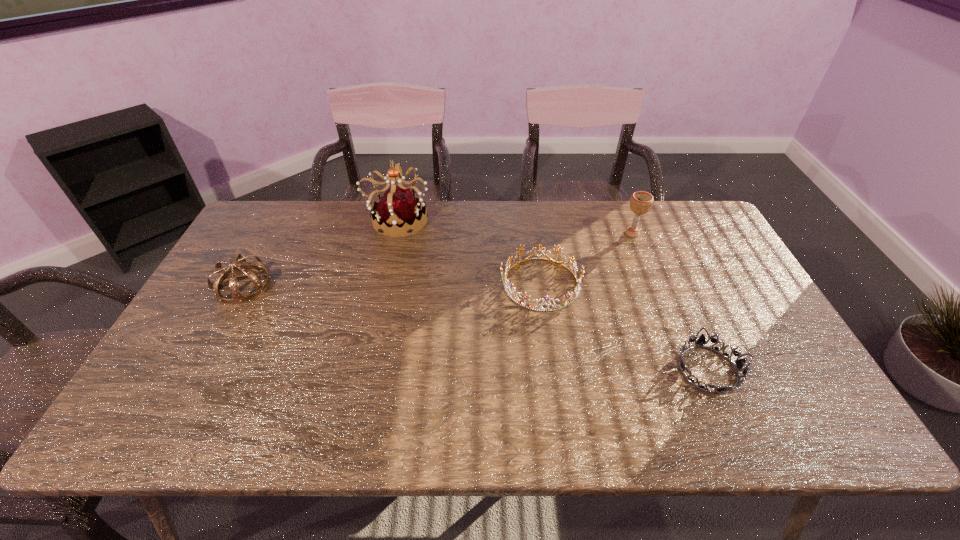
Where is `vacant area situated on the right of the chalice`? vacant area situated on the right of the chalice is located at coordinates (691, 233).

Find the location of a particular element. free space located on the front of the third shortest object is located at coordinates (191, 381).

Image resolution: width=960 pixels, height=540 pixels. I want to click on vacant space located on the front-facing side of the third tiara from left to right, so click(x=462, y=284).

Image resolution: width=960 pixels, height=540 pixels. Find the location of `vacant point located 0.250m on the front-facing side of the third tiara from left to right`. vacant point located 0.250m on the front-facing side of the third tiara from left to right is located at coordinates (414, 284).

This screenshot has height=540, width=960. What are the coordinates of `free space located on the front-facing side of the third tiara from left to right` in the screenshot? It's located at (378, 284).

Find the location of a particular element. Image resolution: width=960 pixels, height=540 pixels. vacant space located 0.390m on the front-facing side of the shortest object is located at coordinates (511, 369).

This screenshot has width=960, height=540. I want to click on free spot located 0.370m on the front-facing side of the shortest object, so click(519, 369).

Where is `vacant space positioned 0.280m on the front-facing side of the shortest object`? This screenshot has height=540, width=960. vacant space positioned 0.280m on the front-facing side of the shortest object is located at coordinates (557, 369).

Image resolution: width=960 pixels, height=540 pixels. Find the location of `tiara that is at the far edge`. tiara that is at the far edge is located at coordinates (398, 208).

At what (x,y) coordinates should I click in order to perform the action: click on chalice at the far edge. Please return your answer as a coordinate pair (x, y). Looking at the image, I should click on (641, 202).